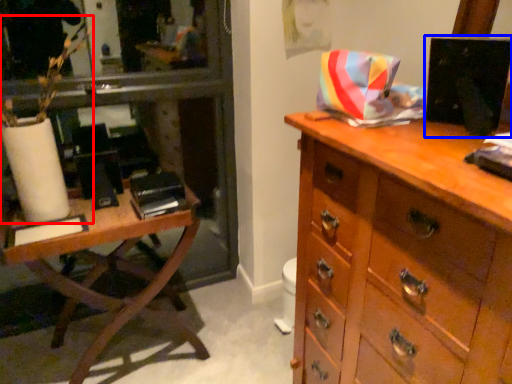
Question: Which object is further to the camera taking this photo, plant (highlighted by a red box) or computer monitor (highlighted by a blue box)?

Choices:
 (A) plant
 (B) computer monitor

Answer: (A)